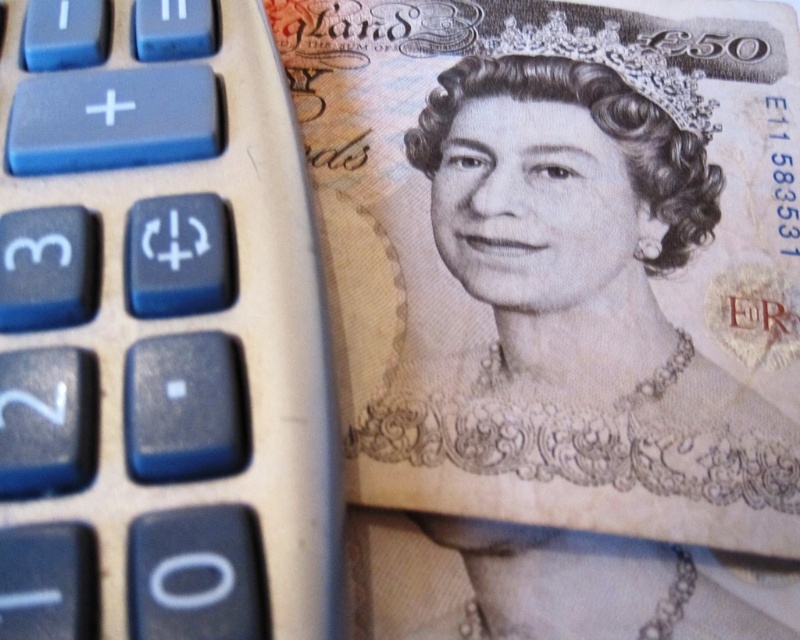
Question: Among these objects, which one is farthest from the camera?

Choices:
 (A) smooth beige portrait at center
 (B) white textured tiara at upper center
 (C) blue plastic calculator at left

Answer: (B)

Question: Does blue plastic calculator at left appear on the right side of smooth beige portrait at center?

Choices:
 (A) no
 (B) yes

Answer: (A)

Question: Which is nearer to the smooth beige portrait at center?

Choices:
 (A) white textured tiara at upper center
 (B) blue plastic calculator at left

Answer: (A)

Question: In this image, where is blue plastic calculator at left located relative to smooth beige portrait at center?

Choices:
 (A) below
 (B) above

Answer: (B)

Question: Which point is closer to the camera?

Choices:
 (A) (254, 280)
 (B) (668, 356)

Answer: (A)

Question: Observing the image, what is the correct spatial positioning of blue plastic calculator at left in reference to white textured tiara at upper center?

Choices:
 (A) below
 (B) above

Answer: (A)